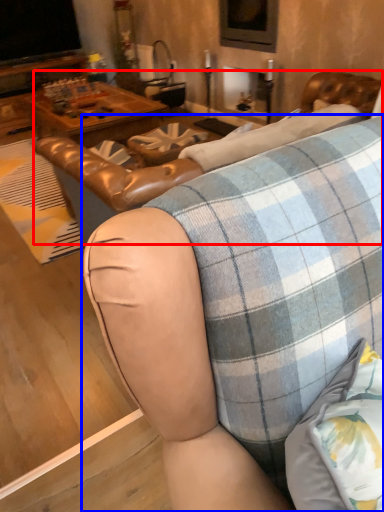
Question: Among these objects, which one is nearest to the camera, swivel chair (highlighted by a red box) or studio couch (highlighted by a blue box)?

Choices:
 (A) swivel chair
 (B) studio couch

Answer: (A)